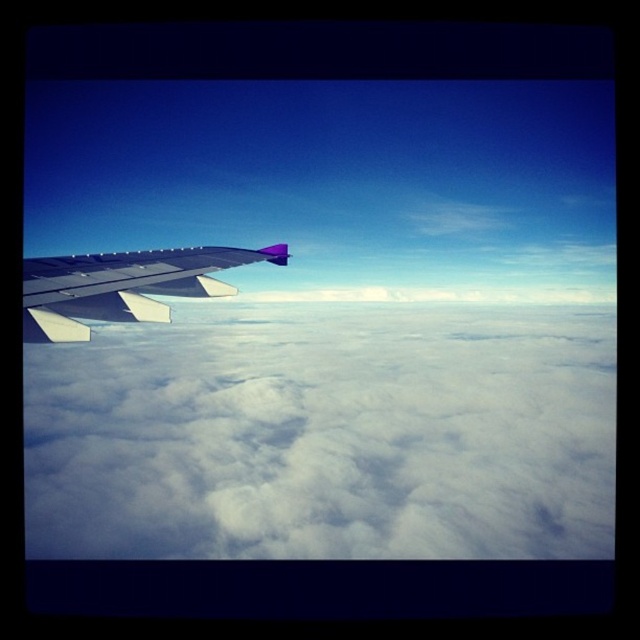
You are a passenger sitting by the window and notice the white fluffy cloud at left and the metallic silver wing at left. Which object is closer to the right edge of the window?

The white fluffy cloud at left is positioned on the right side of the metallic silver wing at left, so it is closer to the right edge of the window.

You are a passenger sitting by the window in the airplane. You notice two points marked on the window. One is at coordinate point (374, 532) and the other is at point (188, 291). Which point is closer to your eyes?

Point (374, 532) is closer to your eyes because it is further to the viewer than point (188, 291).

You are a passenger sitting by the window in an airplane. You see the white fluffy cloud at left and the metallic silver wing at left outside. Which object is closer to your eyes?

The white fluffy cloud at left is closer to your eyes because it is positioned further to the viewer than the metallic silver wing at left.